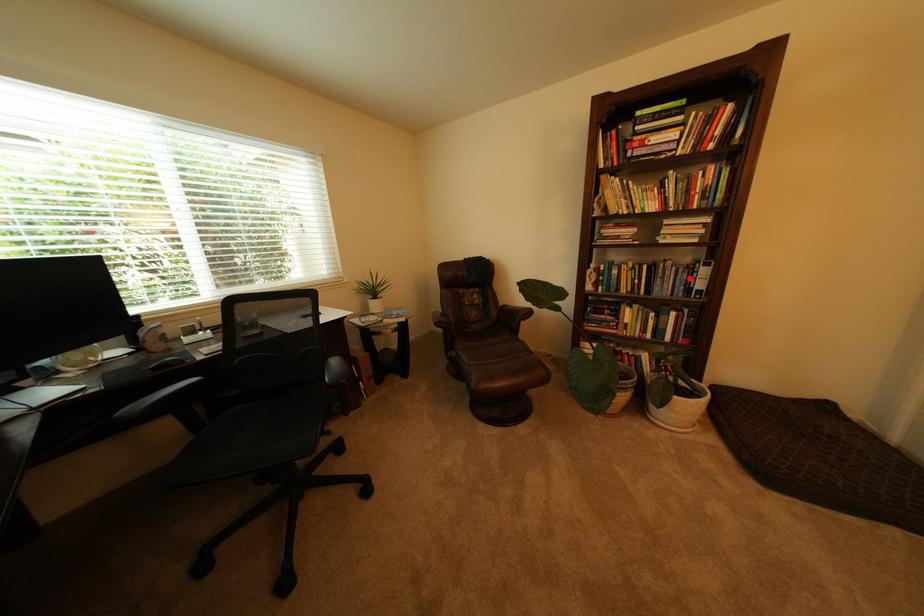
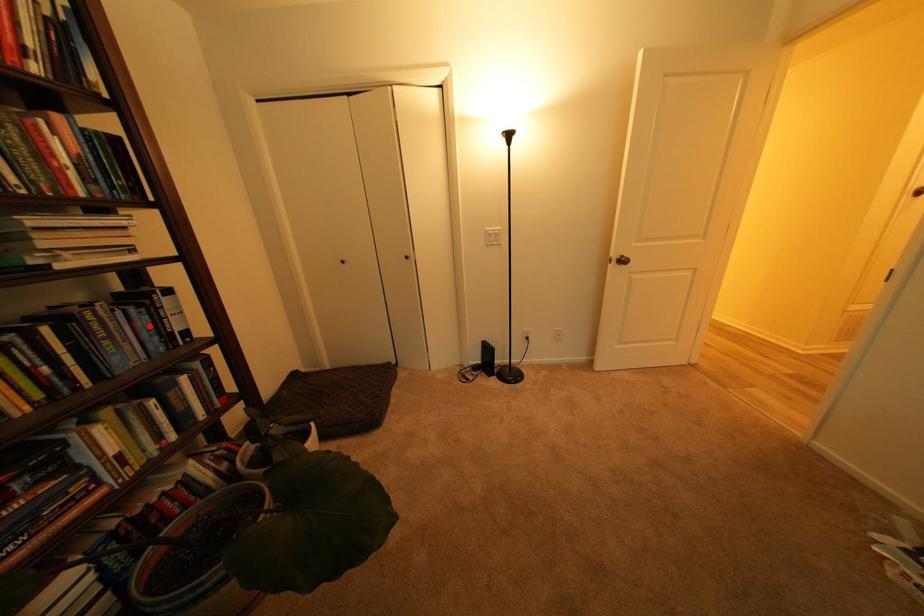
From the picture: I am providing you with two images of the same scene from different viewpoints. A red point is marked on the first image and another point is marked on the second image. Is the marked point in image1 the same physical position as the marked point in image2?

Yes